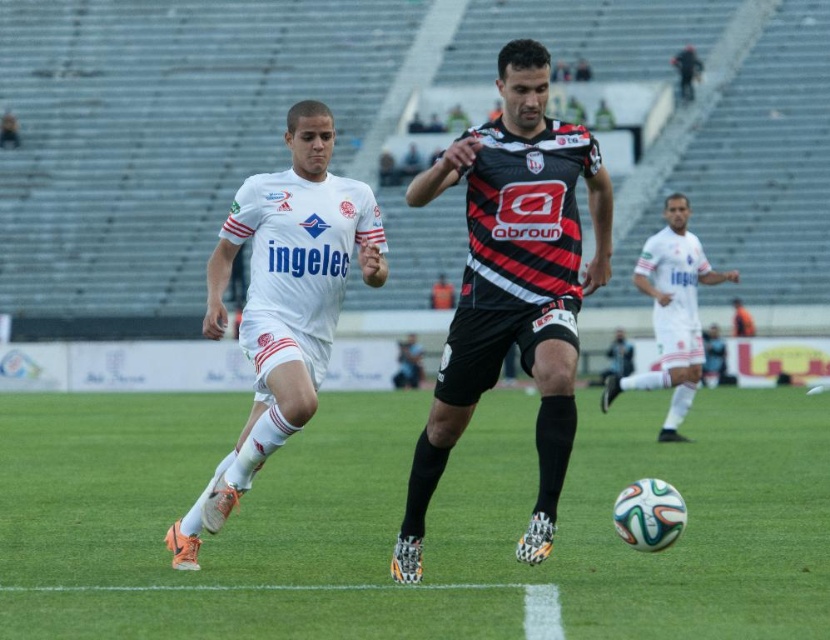
Between green grass at center and white matte uniform at center, which one has less height?

green grass at center

Who is more distant from viewer, (298,520) or (282,352)?

Point (298,520)

Where is `green grass at center`? The image size is (830, 640). green grass at center is located at coordinates 398,520.

Between green grass at center and white matte soccer player at center, which one is positioned lower?

green grass at center is below.

Who is more distant from viewer, [91,406] or [691,282]?

Point [91,406]

Looking at this image, who is more forward, (132, 586) or (664, 360)?

Point (132, 586)

You are a GUI agent. You are given a task and a screenshot of the screen. Output one action in this format:
    pyautogui.click(x=<x>, y=<y>)
    Task: Click on the green grass at center
    
    Given the screenshot: What is the action you would take?
    pyautogui.click(x=398, y=520)

Is black jersey at center closer to the viewer compared to white matte uniform at center?

That is True.

Does black jersey at center have a larger size compared to white matte uniform at center?

No.

Between point (536, 220) and point (289, 132), which one is positioned in front?

Point (536, 220)

The height and width of the screenshot is (640, 830). Identify the location of black jersey at center. [x=511, y=285].